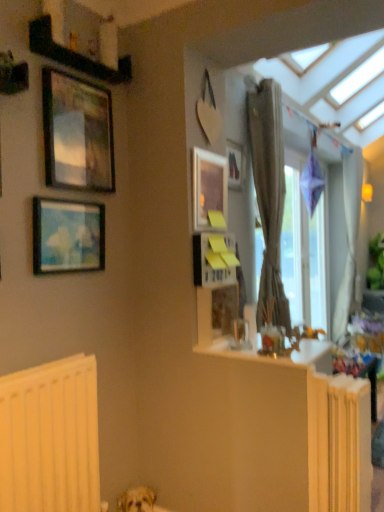
This screenshot has height=512, width=384. What do you see at coordinates (235, 164) in the screenshot? I see `wooden picture frame at upper center, which is the first picture frame from right to left` at bounding box center [235, 164].

Where is `white sheer curtain at right, the second curtain viewed from the front`? The width and height of the screenshot is (384, 512). white sheer curtain at right, the second curtain viewed from the front is located at coordinates (348, 238).

You are a GUI agent. You are given a task and a screenshot of the screen. Output one action in this format:
    pyautogui.click(x=<x>, y=<y>)
    Task: Click on the yellow painted radiator at lower right, which is the first radiator from right to left
    This screenshot has width=384, height=512.
    Given the screenshot: What is the action you would take?
    pyautogui.click(x=339, y=443)

Who is shorter, light brown fur at lower center or white matte radiator at lower left, marked as the second radiator in a right-to-left arrangement?

light brown fur at lower center is shorter.

Is light brown fur at lower center thinner than white matte radiator at lower left, marked as the second radiator in a right-to-left arrangement?

No, light brown fur at lower center is not thinner than white matte radiator at lower left, marked as the second radiator in a right-to-left arrangement.

Does light brown fur at lower center contain white matte radiator at lower left, marked as the second radiator in a right-to-left arrangement?

No, white matte radiator at lower left, marked as the second radiator in a right-to-left arrangement, is located outside of light brown fur at lower center.

Image resolution: width=384 pixels, height=512 pixels. I want to click on the 1st radiator positioned above the light brown fur at lower center (from the image's perspective), so click(50, 437).

Would you say light brown fur at lower center is to the left or to the right of yellow painted radiator at lower right, which is the first radiator from right to left, in the picture?

light brown fur at lower center is positioned on yellow painted radiator at lower right, which is the first radiator from right to left,'s left side.

How many degrees apart are the facing directions of light brown fur at lower center and yellow painted radiator at lower right, the second radiator from the left?

They differ by 42.6 degrees in their facing directions.

Considering the relative sizes of light brown fur at lower center and yellow painted radiator at lower right, the second radiator from the left, in the image provided, is light brown fur at lower center wider than yellow painted radiator at lower right, the second radiator from the left,?

Incorrect, the width of light brown fur at lower center does not surpass that of yellow painted radiator at lower right, the second radiator from the left.

From the image's perspective, relative to wooden picture frame at upper center, the 1th picture frame positioned from the back, is matte blue painting at upper left, which ranks as the 4th picture frame in right-to-left order, above or below?

From the image's perspective, matte blue painting at upper left, which ranks as the 4th picture frame in right-to-left order, appears below wooden picture frame at upper center, the 1th picture frame positioned from the back.

Is matte blue painting at upper left, the fourth picture frame from the back, facing away from wooden picture frame at upper center, which is the first picture frame from right to left?

No, matte blue painting at upper left, the fourth picture frame from the back,'s orientation is not away from wooden picture frame at upper center, which is the first picture frame from right to left.

The height and width of the screenshot is (512, 384). In order to click on picture frame that is the 3rd object located above the matte blue painting at upper left, positioned as the 1th picture frame in left-to-right order (from the image's perspective) in this screenshot , I will do `click(235, 164)`.

How different are the orientations of matte blue painting at upper left, positioned as the first picture frame in front-to-back order, and wooden picture frame at upper center, the 1th picture frame positioned from the back, in degrees?

The facing directions of matte blue painting at upper left, positioned as the first picture frame in front-to-back order, and wooden picture frame at upper center, the 1th picture frame positioned from the back, are 0.588 degrees apart.

Is metallic gold picture frame at upper left, the 2th picture frame from the left, far from yellow painted radiator at lower right, the second radiator from the left?

Yes, metallic gold picture frame at upper left, the 2th picture frame from the left, and yellow painted radiator at lower right, the second radiator from the left, are located far from each other.

Considering the positions of point (45, 108) and point (355, 424), is point (45, 108) closer or farther from the camera than point (355, 424)?

Point (45, 108) appears to be farther away from the viewer than point (355, 424).

Could yellow painted radiator at lower right, the second radiator from the left, be considered to be inside metallic gold picture frame at upper left, acting as the third picture frame starting from the back?

No, yellow painted radiator at lower right, the second radiator from the left, is not inside metallic gold picture frame at upper left, acting as the third picture frame starting from the back.

Based on their sizes in the image, would you say white sheer curtain at right, the first curtain viewed from the back, is bigger or smaller than matte blue painting at upper left, the fourth picture frame from the back?

In the image, white sheer curtain at right, the first curtain viewed from the back, appears to be larger than matte blue painting at upper left, the fourth picture frame from the back.

Is there a large distance between white sheer curtain at right, which ranks as the first curtain in right-to-left order, and matte blue painting at upper left, which ranks as the 4th picture frame in right-to-left order?

Yes, white sheer curtain at right, which ranks as the first curtain in right-to-left order, is far from matte blue painting at upper left, which ranks as the 4th picture frame in right-to-left order.

Measure the distance between white sheer curtain at right, the first curtain viewed from the back, and matte blue painting at upper left, which ranks as the 4th picture frame in right-to-left order.

The distance of white sheer curtain at right, the first curtain viewed from the back, from matte blue painting at upper left, which ranks as the 4th picture frame in right-to-left order, is 3.52 meters.

Between white sheer curtain at right, the second curtain viewed from the front, and matte blue painting at upper left, positioned as the first picture frame in front-to-back order, which one is positioned behind?

white sheer curtain at right, the second curtain viewed from the front, is more distant.

Is black wood shelf at upper left with matte wooden picture frame at upper center, arranged as the 3th picture frame when viewed from the front?

black wood shelf at upper left is not next to matte wooden picture frame at upper center, arranged as the 3th picture frame when viewed from the front, and they're not touching.

Which is in front, point (40, 19) or point (226, 199)?

The point (40, 19) is closer.

Is black wood shelf at upper left bigger or smaller than matte wooden picture frame at upper center, the third picture frame viewed from the left?

Clearly, black wood shelf at upper left is larger in size than matte wooden picture frame at upper center, the third picture frame viewed from the left.

From the picture: Between black wood shelf at upper left and matte wooden picture frame at upper center, the second picture frame viewed from the right, which one appears on the right side from the viewer's perspective?

matte wooden picture frame at upper center, the second picture frame viewed from the right.

Is matte wooden picture frame at upper center, the second picture frame in the back-to-front sequence, wider than white matte radiator at lower left, the 1th radiator in the left-to-right sequence?

No, matte wooden picture frame at upper center, the second picture frame in the back-to-front sequence, is not wider than white matte radiator at lower left, the 1th radiator in the left-to-right sequence.

Is matte wooden picture frame at upper center, the second picture frame viewed from the right, situated inside white matte radiator at lower left, the 1th radiator in the left-to-right sequence, or outside?

The correct answer is: outside.

Considering the positions of objects matte wooden picture frame at upper center, the second picture frame viewed from the right, and white matte radiator at lower left, marked as the second radiator in a right-to-left arrangement, in the image provided, who is behind, matte wooden picture frame at upper center, the second picture frame viewed from the right, or white matte radiator at lower left, marked as the second radiator in a right-to-left arrangement,?

matte wooden picture frame at upper center, the second picture frame viewed from the right.

Is matte wooden picture frame at upper center, arranged as the 3th picture frame when viewed from the front, aimed at white matte radiator at lower left, marked as the second radiator in a right-to-left arrangement?

No.

This screenshot has width=384, height=512. In order to click on the 2nd radiator positioned above the light brown fur at lower center (from a real-world perspective) in this screenshot , I will do `click(50, 437)`.

Where is `dog located below the yellow painted radiator at lower right, the second radiator from the left (from the image's perspective)`? The image size is (384, 512). dog located below the yellow painted radiator at lower right, the second radiator from the left (from the image's perspective) is located at coordinates (137, 500).

Looking at this image, from the image, which object appears to be nearer to matte blue painting at upper left, which ranks as the 4th picture frame in right-to-left order, matte wooden picture frame at upper center, the third picture frame viewed from the left, or yellow painted radiator at lower right, the second radiator from the left?

matte wooden picture frame at upper center, the third picture frame viewed from the left, is closer to matte blue painting at upper left, which ranks as the 4th picture frame in right-to-left order.

Considering their positions, is yellow painted radiator at lower right, the second radiator from the left, positioned further to metallic gold picture frame at upper left, arranged as the 2th picture frame when viewed from the front, than matte blue painting at upper left, positioned as the 1th picture frame in left-to-right order?

yellow painted radiator at lower right, the second radiator from the left, is positioned further to the anchor metallic gold picture frame at upper left, arranged as the 2th picture frame when viewed from the front.

Estimate the real-world distances between objects in this image. Which object is further from textured beige curtain at right, which is the 1th curtain in front-to-back order, metallic gold picture frame at upper left, arranged as the 2th picture frame when viewed from the front, or white matte radiator at lower left, marked as the second radiator in a right-to-left arrangement?

white matte radiator at lower left, marked as the second radiator in a right-to-left arrangement.

Which object lies nearer to the anchor point white matte radiator at lower left, the 1th radiator in the left-to-right sequence, white sheer curtain at right, which ranks as the first curtain in right-to-left order, or metallic gold picture frame at upper left, acting as the third picture frame starting from the back?

The object closer to white matte radiator at lower left, the 1th radiator in the left-to-right sequence, is metallic gold picture frame at upper left, acting as the third picture frame starting from the back.

Looking at the image, which one is located closer to yellow painted radiator at lower right, the second radiator from the left, matte wooden picture frame at upper center, the second picture frame in the back-to-front sequence, or metallic gold picture frame at upper left, which ranks as the 3th picture frame in right-to-left order?

matte wooden picture frame at upper center, the second picture frame in the back-to-front sequence.

Based on the photo, looking at the image, which one is located further to metallic gold picture frame at upper left, acting as the third picture frame starting from the back, black wood shelf at upper left or white sheer curtain at right, the first curtain viewed from the back?

white sheer curtain at right, the first curtain viewed from the back, is further to metallic gold picture frame at upper left, acting as the third picture frame starting from the back.

Considering their positions, is transparent glass window at right positioned further to metallic gold picture frame at upper left, which ranks as the 3th picture frame in right-to-left order, than light brown fur at lower center?

transparent glass window at right.

Based on the photo, considering their positions, is wooden picture frame at upper center, which is the first picture frame from right to left, positioned further to transparent glass window at right than white matte radiator at lower left, marked as the second radiator in a right-to-left arrangement?

white matte radiator at lower left, marked as the second radiator in a right-to-left arrangement, is further to transparent glass window at right.

This screenshot has width=384, height=512. Identify the location of radiator between black wood shelf at upper left and white matte radiator at lower left, the 1th radiator in the left-to-right sequence, from top to bottom. (339, 443).

At what (x,y) coordinates should I click in order to perform the action: click on curtain located between matte blue painting at upper left, the fourth picture frame from the back, and yellow painted radiator at lower right, the second radiator from the left, in the left-right direction. Please return your answer as a coordinate pair (x, y). This screenshot has width=384, height=512. Looking at the image, I should click on (269, 195).

Find the location of a particular element. shelf between yellow painted radiator at lower right, the second radiator from the left, and white sheer curtain at right, the first curtain viewed from the back, from front to back is located at coordinates (74, 54).

Where is `radiator between wooden picture frame at upper center, which is the 4th picture frame in left-to-right order, and white matte radiator at lower left, marked as the second radiator in a right-to-left arrangement, vertically`? The image size is (384, 512). radiator between wooden picture frame at upper center, which is the 4th picture frame in left-to-right order, and white matte radiator at lower left, marked as the second radiator in a right-to-left arrangement, vertically is located at coordinates (339, 443).